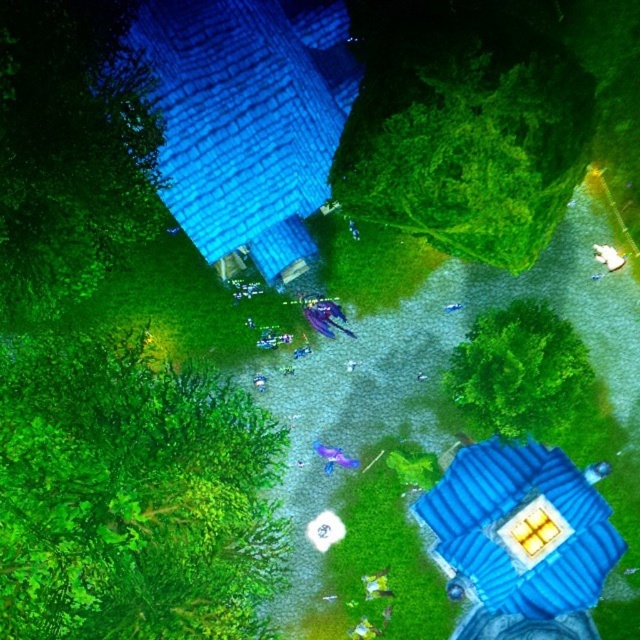
Is green leafy tree at upper left bigger than green leafy tree at center?

Indeed, green leafy tree at upper left has a larger size compared to green leafy tree at center.

The height and width of the screenshot is (640, 640). What do you see at coordinates (72, 148) in the screenshot?
I see `green leafy tree at upper left` at bounding box center [72, 148].

This screenshot has height=640, width=640. What are the coordinates of `green leafy tree at upper left` in the screenshot? It's located at (72, 148).

Is green leafy tree at upper center thinner than green leafy tree at upper left?

Incorrect, green leafy tree at upper center's width is not less than green leafy tree at upper left's.

Which is below, green leafy tree at upper center or green leafy tree at upper left?

green leafy tree at upper left is below.

The image size is (640, 640). What are the coordinates of `green leafy tree at upper center` in the screenshot? It's located at (467, 141).

The image size is (640, 640). Find the location of `green leafy tree at upper center`. green leafy tree at upper center is located at coordinates (467, 141).

Between point (237, 548) and point (456, 56), which one is positioned behind?

Positioned behind is point (237, 548).

Where is `green leafy tree at lower left`? The height and width of the screenshot is (640, 640). green leafy tree at lower left is located at coordinates (131, 497).

Locate an element on the screen. The image size is (640, 640). green leafy tree at lower left is located at coordinates (131, 497).

Where is `green leafy tree at lower left`? green leafy tree at lower left is located at coordinates (131, 497).